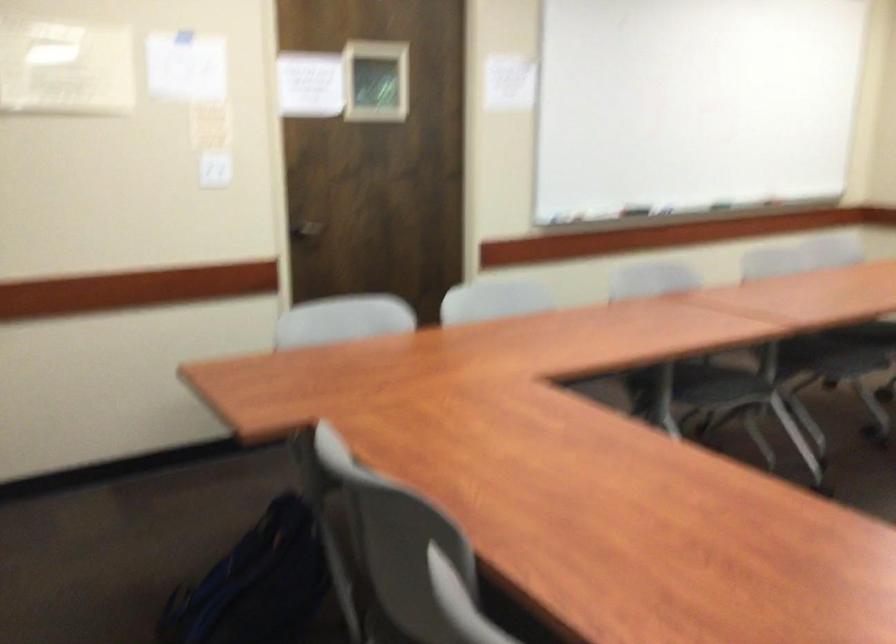
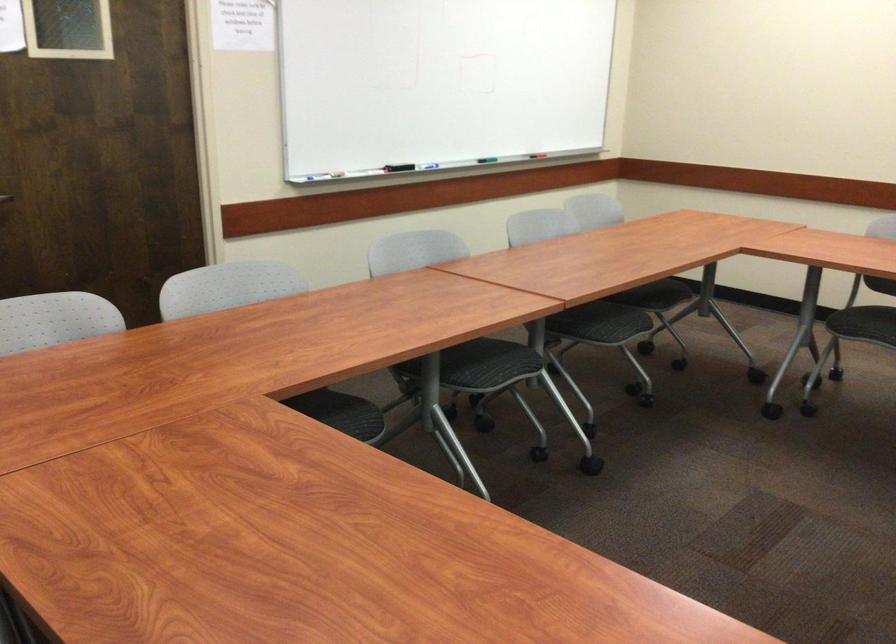
The point at (530, 337) is marked in the first image. Where is the corresponding point in the second image?

(265, 330)